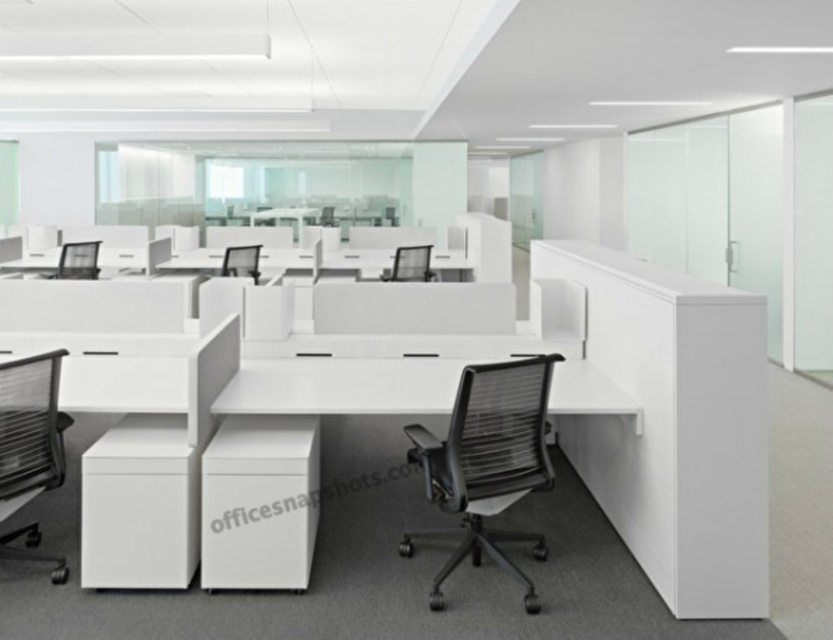
Is black mesh swivel chair at center below white matte desk at center?

Yes, black mesh swivel chair at center is below white matte desk at center.

Measure the distance between black mesh swivel chair at center and white matte desk at center.

black mesh swivel chair at center and white matte desk at center are 61.45 centimeters apart.

The width and height of the screenshot is (833, 640). I want to click on black mesh swivel chair at center, so click(x=489, y=460).

How distant is black mesh swivel chair at center from black mesh swivel chair at left?

black mesh swivel chair at center is 6.99 feet away from black mesh swivel chair at left.

Is point (535, 380) more distant than point (56, 448)?

No, it is not.

Which is behind, point (532, 358) or point (13, 512)?

The point (13, 512) is behind.

Locate an element on the screen. The height and width of the screenshot is (640, 833). black mesh swivel chair at center is located at coordinates (489, 460).

Is point (203, 408) positioned in front of point (228, 275)?

Yes, point (203, 408) is in front of point (228, 275).

Is point (439, 369) farther from viewer compared to point (252, 276)?

No, it is not.

Locate an element on the screen. white matte desk at center is located at coordinates (325, 387).